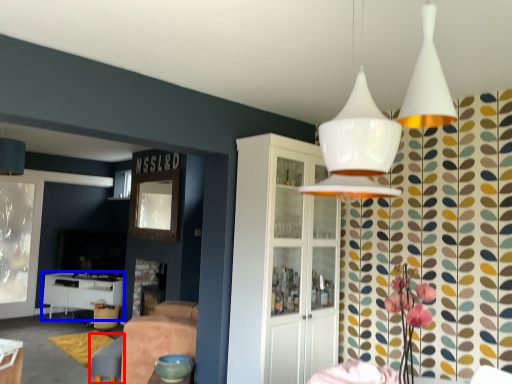
Question: Among these objects, which one is nearest to the camera, swivel chair (highlighted by a red box) or table (highlighted by a blue box)?

Choices:
 (A) swivel chair
 (B) table

Answer: (A)